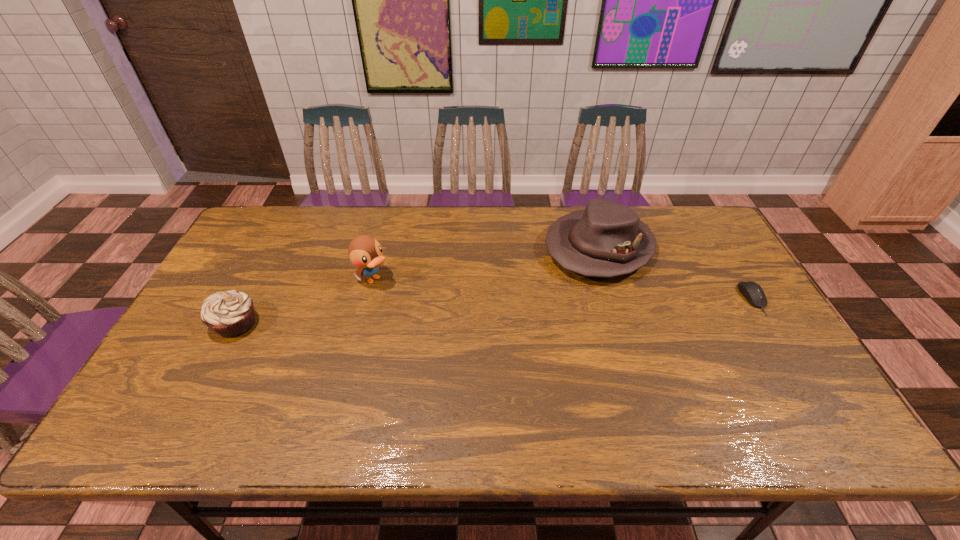
Locate an element on the screen. The width and height of the screenshot is (960, 540). free space between the computer mouse and the second object from right to left is located at coordinates (676, 273).

Image resolution: width=960 pixels, height=540 pixels. In order to click on free space between the leftmost object and the hat in this screenshot , I will do click(418, 286).

Where is `object that is the closest to the second object from right to left`? The height and width of the screenshot is (540, 960). object that is the closest to the second object from right to left is located at coordinates (754, 294).

Select which object appears as the second closest to the computer mouse. Please provide its 2D coordinates. Your answer should be formatted as a tuple, i.e. [(x, y)], where the tuple contains the x and y coordinates of a point satisfying the conditions above.

[(365, 252)]

Where is `vacant space that satisfies the following two spatial constraints: 1. on the back side of the muffin; 2. on the right side of the hat`? This screenshot has width=960, height=540. vacant space that satisfies the following two spatial constraints: 1. on the back side of the muffin; 2. on the right side of the hat is located at coordinates (275, 248).